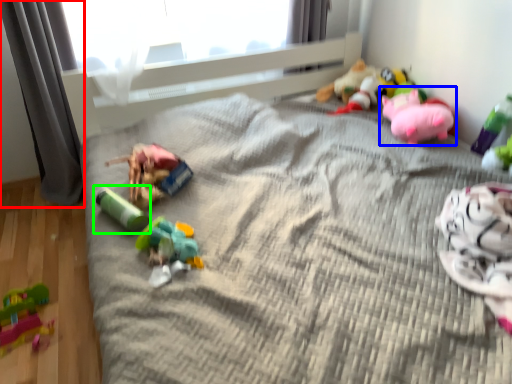
Question: Based on their relative distances, which object is farther from curtain (highlighted by a red box)? Choose from toy (highlighted by a blue box) and toy (highlighted by a green box).

Choices:
 (A) toy
 (B) toy

Answer: (A)